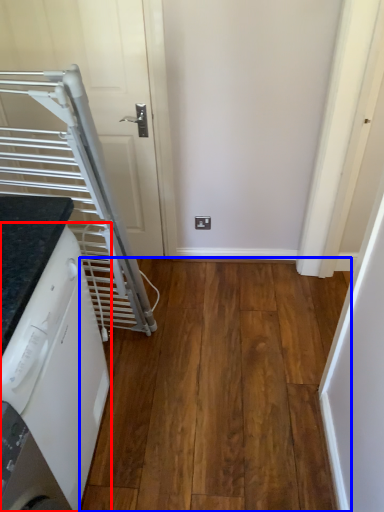
Question: Which of the following is the farthest to the observer, home appliance (highlighted by a red box) or hardwood (highlighted by a blue box)?

Choices:
 (A) home appliance
 (B) hardwood

Answer: (B)